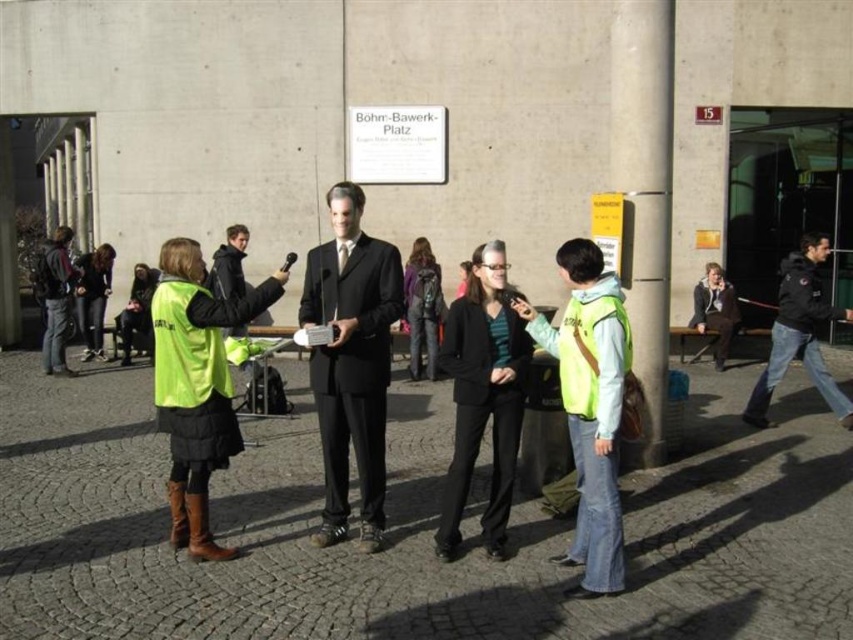
Between point (184, 419) and point (607, 364), which one is positioned behind?

The point (184, 419) is more distant.

Can you confirm if neon yellow vest at center is taller than reflective yellow vest at center?

No, neon yellow vest at center is not taller than reflective yellow vest at center.

Is point (286, 273) positioned behind point (563, 387)?

Yes, it is behind point (563, 387).

This screenshot has width=853, height=640. In order to click on neon yellow vest at center in this screenshot , I will do `click(196, 385)`.

Is matte black suit at center positioned before neon yellow safety vest at left?

No, it is not.

Can you confirm if matte black suit at center is positioned below neon yellow safety vest at left?

Correct, matte black suit at center is located below neon yellow safety vest at left.

Is point (341, 218) farther from camera compared to point (173, 358)?

Yes.

Locate an element on the screen. The image size is (853, 640). matte black suit at center is located at coordinates (351, 362).

Consider the image. Is black smooth pants at center bigger than neon yellow safety vest at left?

Indeed, black smooth pants at center has a larger size compared to neon yellow safety vest at left.

Who is positioned more to the left, black smooth pants at center or neon yellow safety vest at left?

From the viewer's perspective, neon yellow safety vest at left appears more on the left side.

Who is more distant from viewer, (468,410) or (161,326)?

Point (468,410)

In order to click on black smooth pants at center in this screenshot , I will do click(483, 406).